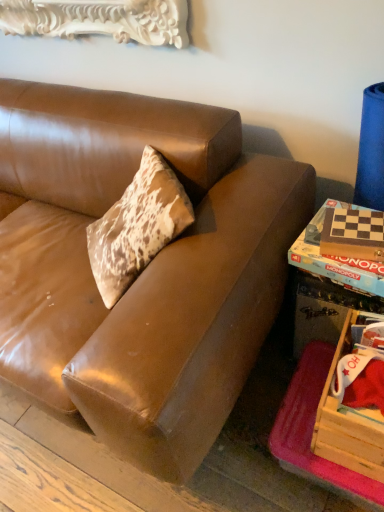
Question: Looking at their shapes, would you say wooden monopoly game at right, placed as the first book when sorted from back to front, is wider or thinner than checkerboard wood game board at right, the first book when ordered from front to back?

Choices:
 (A) thin
 (B) wide

Answer: (B)

Question: Based on their sizes in the image, would you say wooden monopoly game at right, placed as the first book when sorted from back to front, is bigger or smaller than checkerboard wood game board at right, the second book from the back?

Choices:
 (A) big
 (B) small

Answer: (A)

Question: Which is farther from the brown leather couch at center?

Choices:
 (A) wooden monopoly game at right, placed as the second book when sorted from front to back
 (B) white carved wood picture frame at upper left
 (C) checkerboard wood game board at right, the first book when ordered from front to back
 (D) wooden crate at lower right
 (E) wooden game board at lower right

Answer: (B)

Question: Which of these objects is positioned farthest from the wooden monopoly game at right, placed as the first book when sorted from back to front?

Choices:
 (A) white carved wood picture frame at upper left
 (B) wooden game board at lower right
 (C) checkerboard wood game board at right, the second book from the back
 (D) brown leather couch at center
 (E) wooden crate at lower right

Answer: (A)